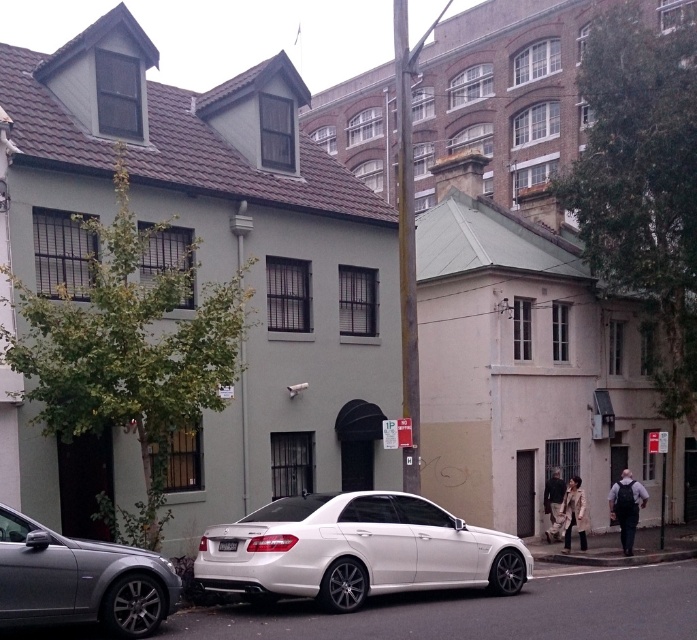
You are a delivery driver trying to park your truck, which is 2 meters wide, in the space between the white metallic car at center and the gray concrete curb at lower center. Based on the scene, can your truck fit widthwise in that space?

The white metallic car at center is wider than the gray concrete curb at lower center. Since the truck is 2 meters wide, it depends on the actual width of the car and curb. However, since the car is wider, the space between them might be insufficient for the truck to fit widthwise.

You are a delivery person trying to park a new car that is the same size as the white metallic car at center. The parking spot you want to use is marked by the gray concrete curb at lower center. Can your new car fit into this parking spot based on their sizes?

The white metallic car at center is larger than the gray concrete curb at lower center. Since the parking spot is indicated by the curb, the size of the curb may not directly determine if the car can fit. However, since the car is larger than the curb, there might not be enough space. It is recommended to check the actual parking dimensions before proceeding.

Based on the photo, you are standing at the point with coordinates point (79, 580). What object are you standing on?

You are standing on the silver metallic sedan at lower left.